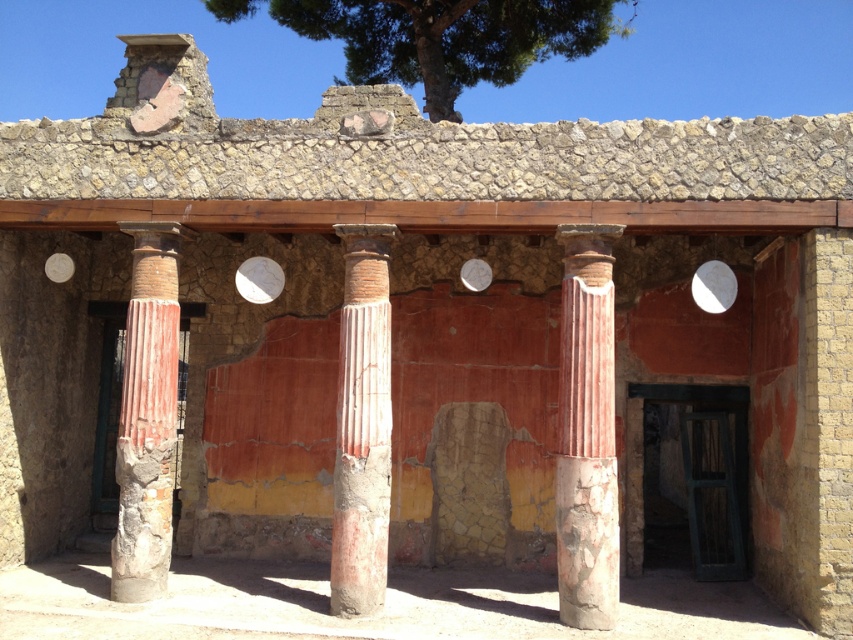
You are an archaeologist examining the ancient Roman structure. You notice a point marked at coordinates (585, 433). Based on the scene description, which object does this point most likely correspond to?

The point at coordinates (585, 433) corresponds to the red marble column at center.

You are an archaeologist examining the ancient Roman structure. You notice two points marked on the image. Which point, point (341, 326) or point (164, 502), is nearer to you as you stand in front of the structure?

Point (341, 326) is closer to the viewer than point (164, 502).